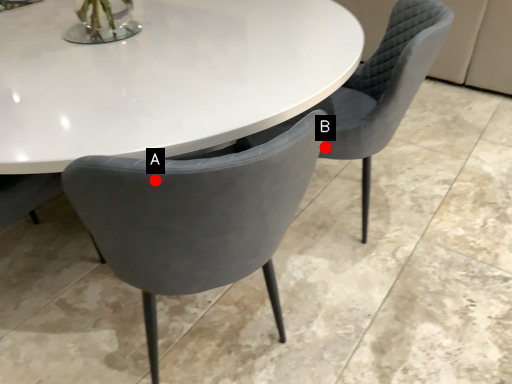
Question: Two points are circled on the image, labeled by A and B beside each circle. Among these points, which one is nearest to the camera?

Choices:
 (A) A is closer
 (B) B is closer

Answer: (A)